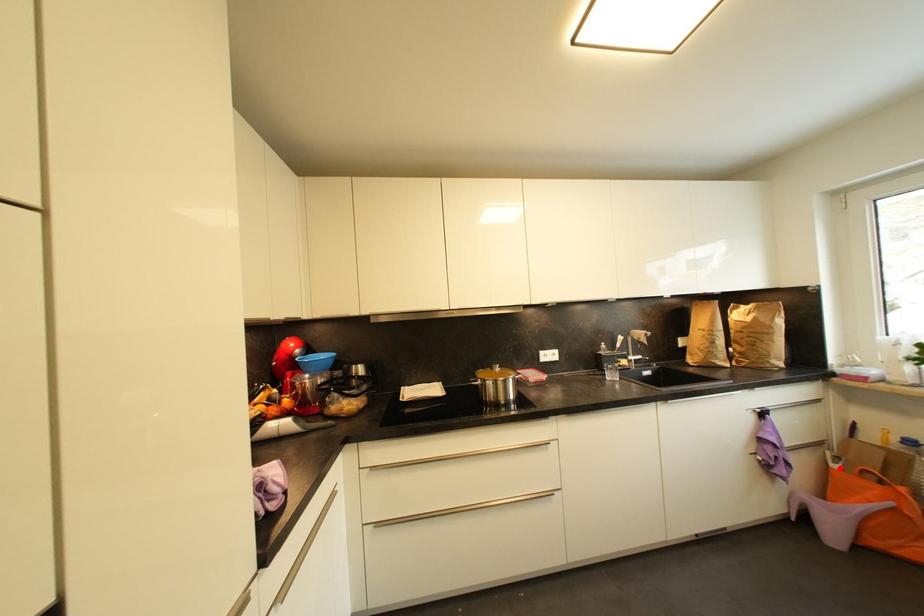
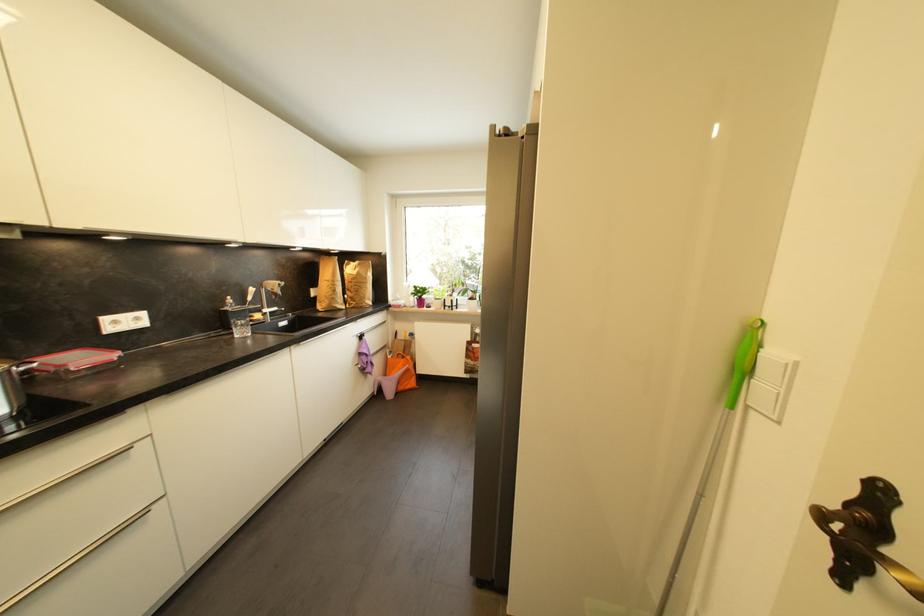
Where in the second image is the point corresponding to the highlighted location from the first image?

(395, 359)